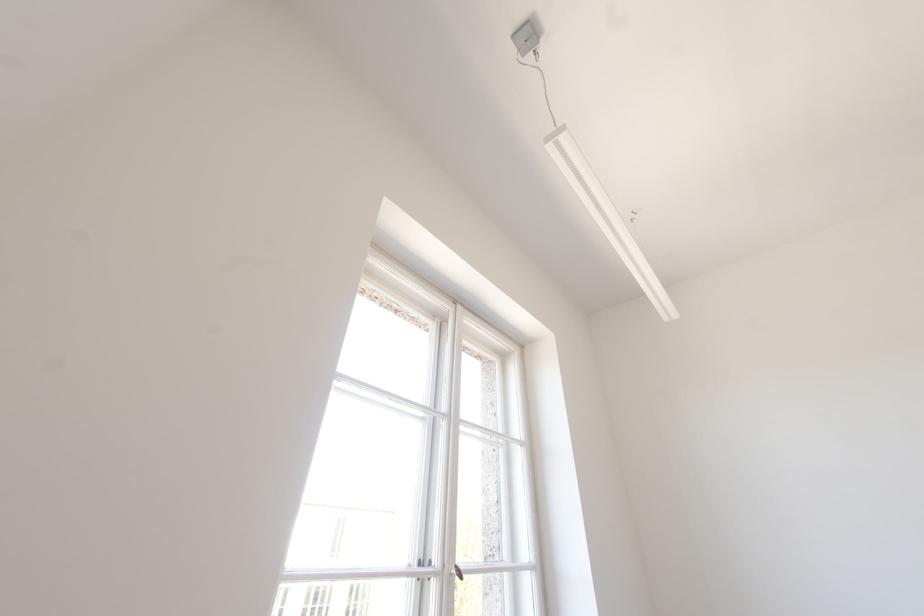
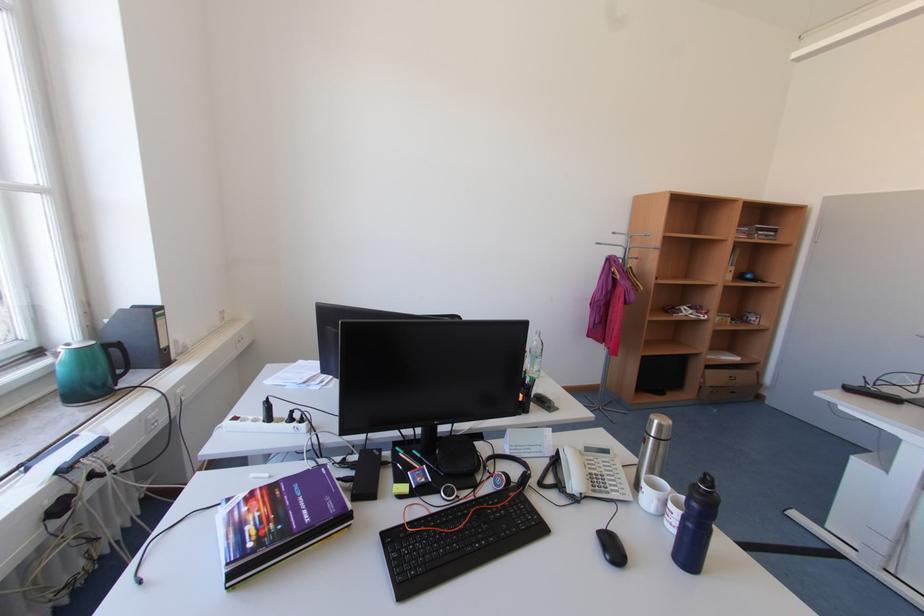
The first image is from the beginning of the video and the second image is from the end. How did the camera likely rotate when shooting the video?

The rotation direction of the camera is right-down.